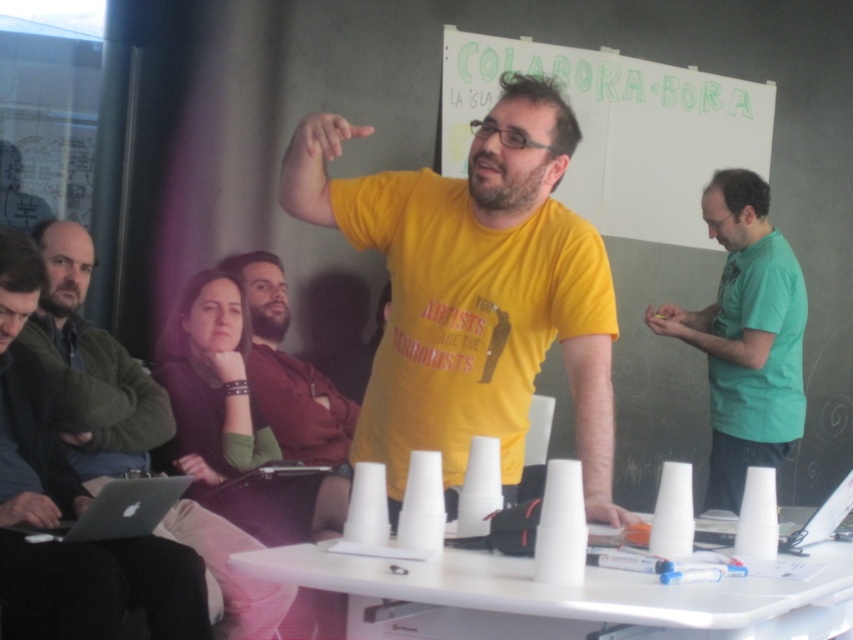
Is white matte paperboard at upper center further to camera compared to matte black laptop at left?

Yes, it is.

Does white matte paperboard at upper center have a greater height compared to matte black laptop at left?

Indeed, white matte paperboard at upper center has a greater height compared to matte black laptop at left.

The image size is (853, 640). Find the location of `white matte paperboard at upper center`. white matte paperboard at upper center is located at coordinates (619, 132).

Where is `white matte paperboard at upper center`? The width and height of the screenshot is (853, 640). white matte paperboard at upper center is located at coordinates (619, 132).

From the picture: Is yellow matte t-shirt at center shorter than bearded man at center?

In fact, yellow matte t-shirt at center may be taller than bearded man at center.

Looking at this image, who is positioned more to the right, yellow matte t-shirt at center or bearded man at center?

yellow matte t-shirt at center is more to the right.

What are the coordinates of `yellow matte t-shirt at center` in the screenshot? It's located at (473, 288).

Is white plastic cups at center to the right of bearded man at center from the viewer's perspective?

Correct, you'll find white plastic cups at center to the right of bearded man at center.

Who is shorter, white plastic cups at center or bearded man at center?

Standing shorter between the two is white plastic cups at center.

Is point (595, 609) behind point (254, 308)?

No, it is not.

Locate an element on the screen. white plastic cups at center is located at coordinates (560, 596).